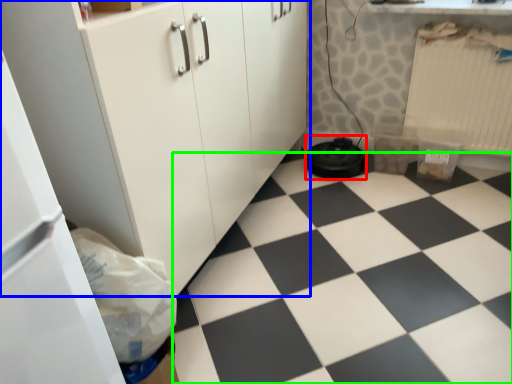
Question: Estimate the real-world distances between objects in this image. Which object is farther from water heater (highlighted by a red box), cabinetry (highlighted by a blue box) or plain (highlighted by a green box)?

Choices:
 (A) cabinetry
 (B) plain

Answer: (A)